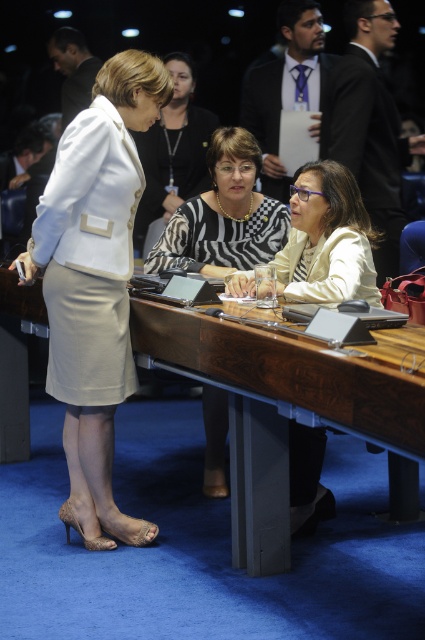
You are a photographer setting up for a group photo. You need to arrange the subjects so that the formal black suit at upper center and the white matte blazer at upper left are both visible in the frame. Based on their current positions, which one is closer to the camera?

The white matte blazer at upper left is closer to the camera because the formal black suit at upper center is positioned under it, indicating it is behind and further away.